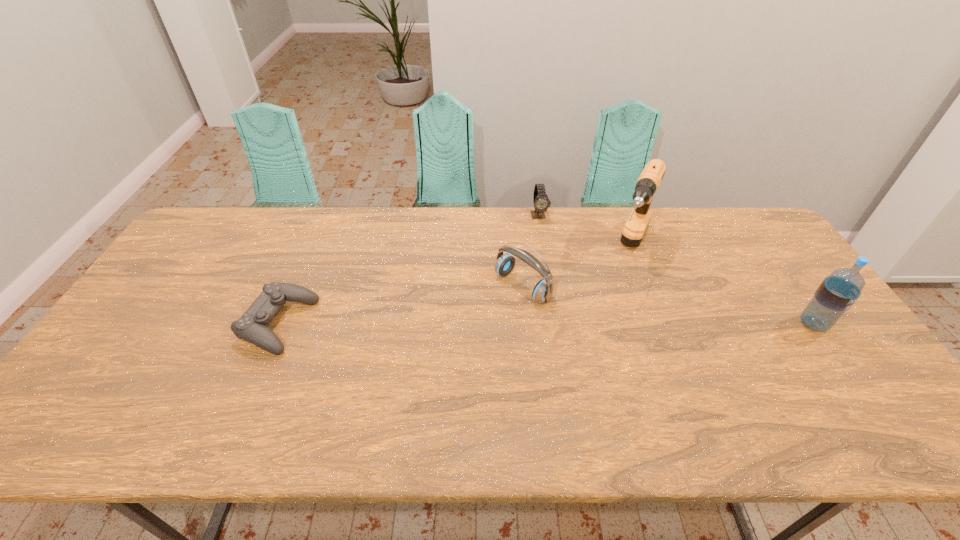
Find the location of a particular element. free space at the far edge of the desktop is located at coordinates (551, 247).

The image size is (960, 540). Find the location of `vacant space at the near edge`. vacant space at the near edge is located at coordinates (400, 389).

This screenshot has width=960, height=540. In the image, there is a desktop. In order to click on free space at the left edge in this screenshot , I will do `click(152, 360)`.

Find the location of `empty space between the drill and the rightmost object`. empty space between the drill and the rightmost object is located at coordinates (722, 286).

Locate an element on the screen. This screenshot has width=960, height=540. free area in between the second object from right to left and the third shortest object is located at coordinates (576, 267).

Find the location of `empty space between the fourth object from left to right and the leftmost object`. empty space between the fourth object from left to right and the leftmost object is located at coordinates pos(455,286).

I want to click on empty location between the third shortest object and the shortest object, so click(x=401, y=306).

Identify the location of free spot between the water bottle and the fourth tallest object. click(676, 269).

The image size is (960, 540). In order to click on vacant space that is in between the watch and the fourth object from left to right in this screenshot , I will do `click(585, 232)`.

The height and width of the screenshot is (540, 960). Find the location of `free area in between the second object from right to left and the third shortest object`. free area in between the second object from right to left and the third shortest object is located at coordinates (576, 267).